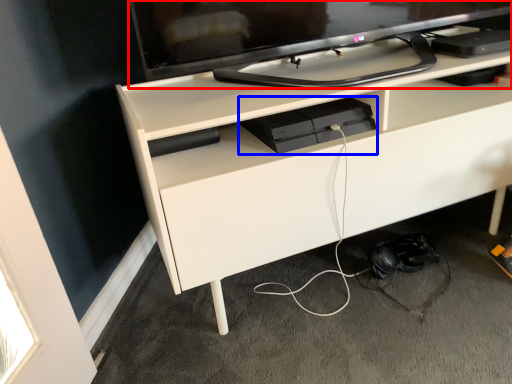
Question: Which point is further to the camera, television (highlighted by a red box) or equipment (highlighted by a blue box)?

Choices:
 (A) television
 (B) equipment

Answer: (B)